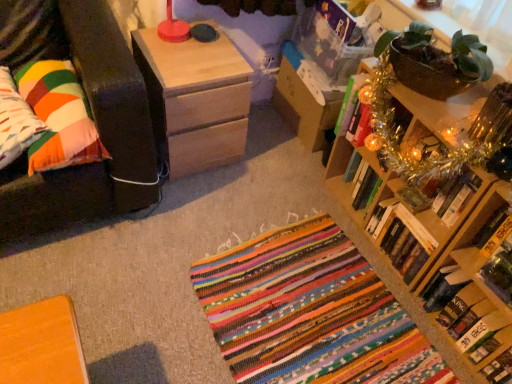
Find the location of a particular element. Image resolution: width=512 pixels, height=384 pixels. spots to the right of natural wood nightstand at upper left is located at coordinates (262, 160).